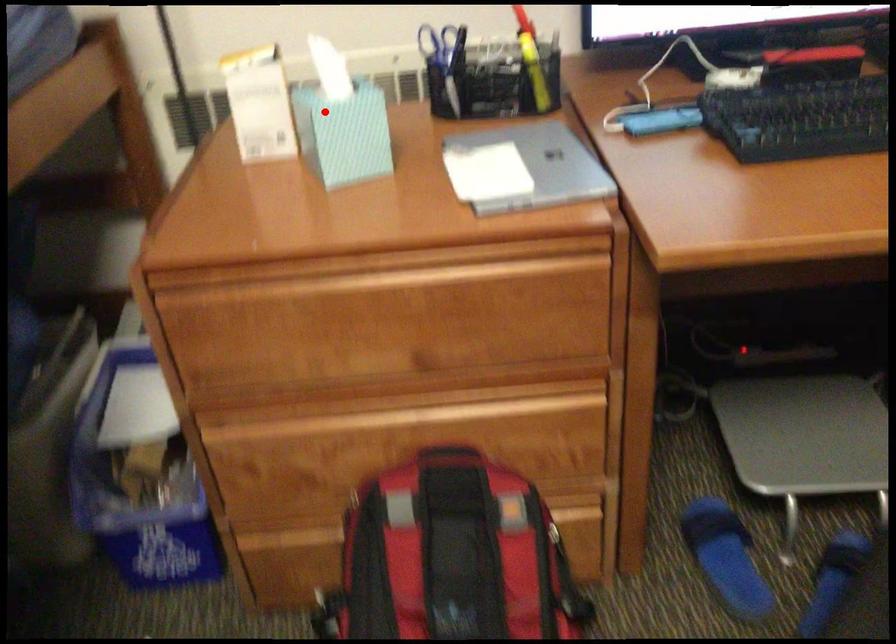
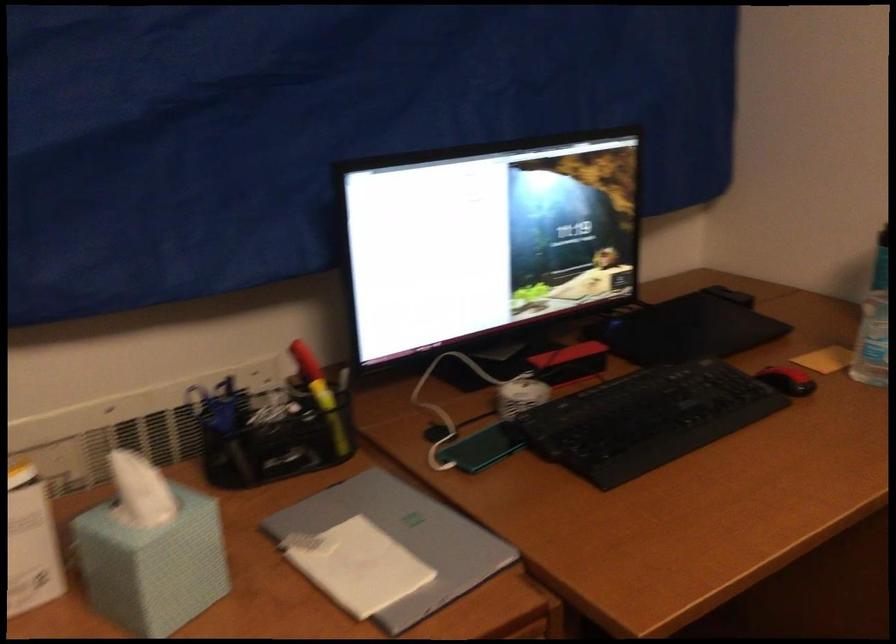
Find the pixel in the second image that matches the highlighted location in the first image.

(150, 550)